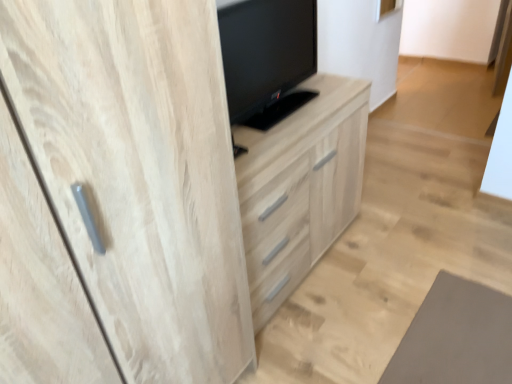
The image size is (512, 384). I want to click on vacant space underneath black glossy tv at center (from a real-world perspective), so click(287, 111).